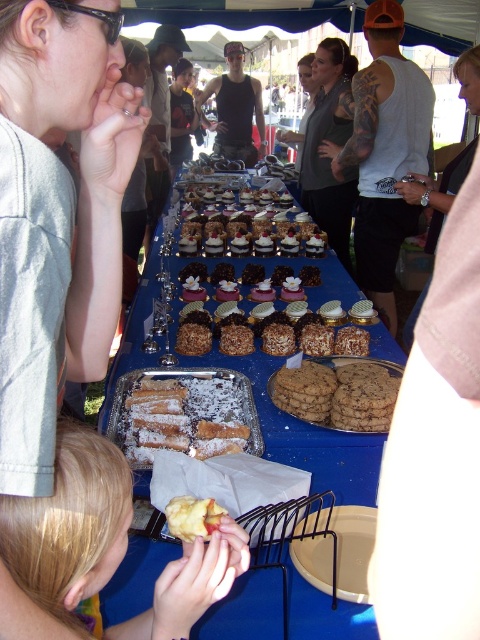
You are at the community event and want to take a photo of the dessert table. There is a person wearing a matte gray shirt at upper left blocking your view. Can you move to the right to get a clear shot of the desserts?

The matte gray shirt at upper left is located at point (57, 218), so moving to the right might help avoid the person blocking the view.